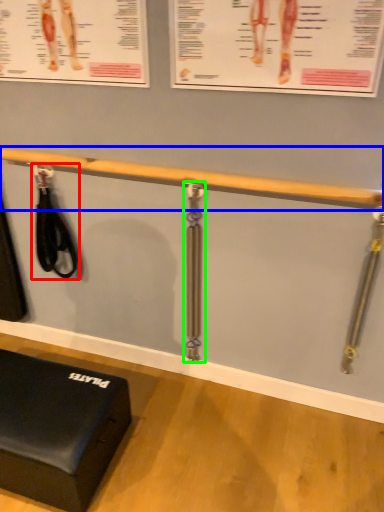
Question: Based on their relative distances, which object is farther from tool (highlighted by a red box)? Choose from beam (highlighted by a blue box) and tool (highlighted by a green box).

Choices:
 (A) beam
 (B) tool

Answer: (B)